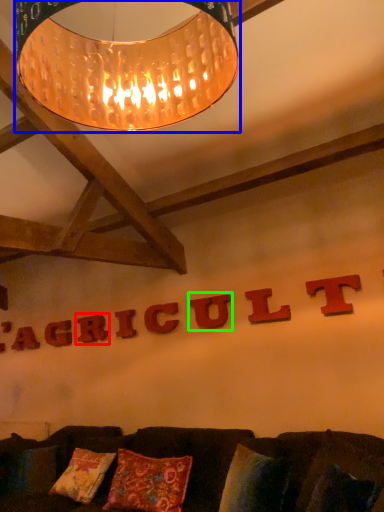
Question: Which object is positioned closest to letter (highlighted by a red box)? Select from lamp (highlighted by a blue box) and letter (highlighted by a green box).

Choices:
 (A) lamp
 (B) letter

Answer: (B)